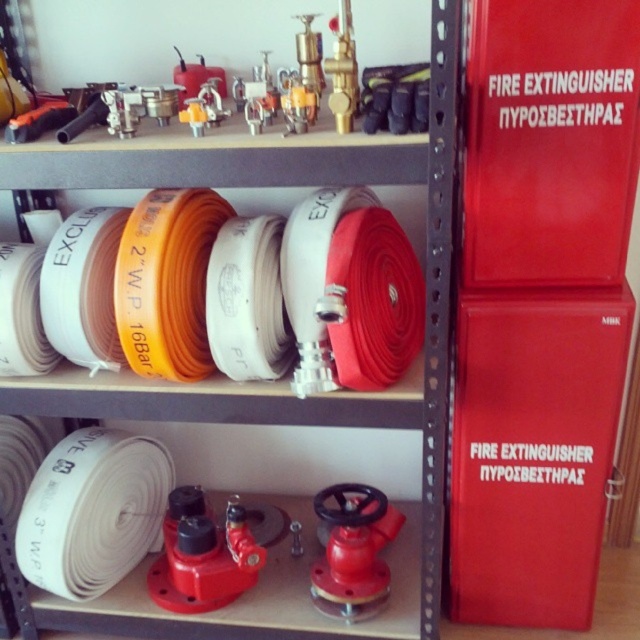
Is red matte fire extinguisher at center right positioned before red matte fire extinguisher at right?

No, it is behind red matte fire extinguisher at right.

Does red matte fire extinguisher at center right have a larger size compared to red matte fire extinguisher at right?

Yes.

Is point (548, 346) behind point (472, 285)?

No, it is not.

Identify the location of red matte fire extinguisher at center right. This screenshot has width=640, height=640. (532, 451).

Does red matte fire extinguisher at right have a greater width compared to white rubber hose at upper center?

No.

Does red matte fire extinguisher at right lie behind white rubber hose at upper center?

Yes, red matte fire extinguisher at right is further from the viewer.

Is point (618, 282) farther from camera compared to point (58, 161)?

Yes, it is behind point (58, 161).

You are a GUI agent. You are given a task and a screenshot of the screen. Output one action in this format:
    pyautogui.click(x=<x>, y=<y>)
    Task: Click on the red matte fire extinguisher at right
    The width and height of the screenshot is (640, 640).
    Given the screenshot: What is the action you would take?
    pyautogui.click(x=548, y=141)

Can you confirm if red matte fire extinguisher at center right is shorter than white rubber hose at upper center?

Correct, red matte fire extinguisher at center right is not as tall as white rubber hose at upper center.

Which is more to the right, red matte fire extinguisher at center right or white rubber hose at upper center?

red matte fire extinguisher at center right

Does point (548, 452) lie behind point (429, 148)?

That is True.

Identify the location of red matte fire extinguisher at center right. (532, 451).